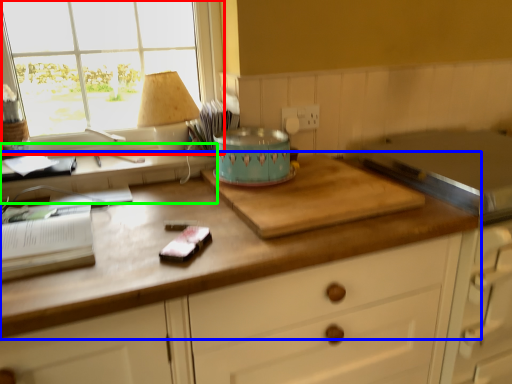
Question: Considering the real-world distances, which object is farthest from window (highlighted by a red box)? countertop (highlighted by a blue box) or computer desk (highlighted by a green box)?

Choices:
 (A) countertop
 (B) computer desk

Answer: (A)